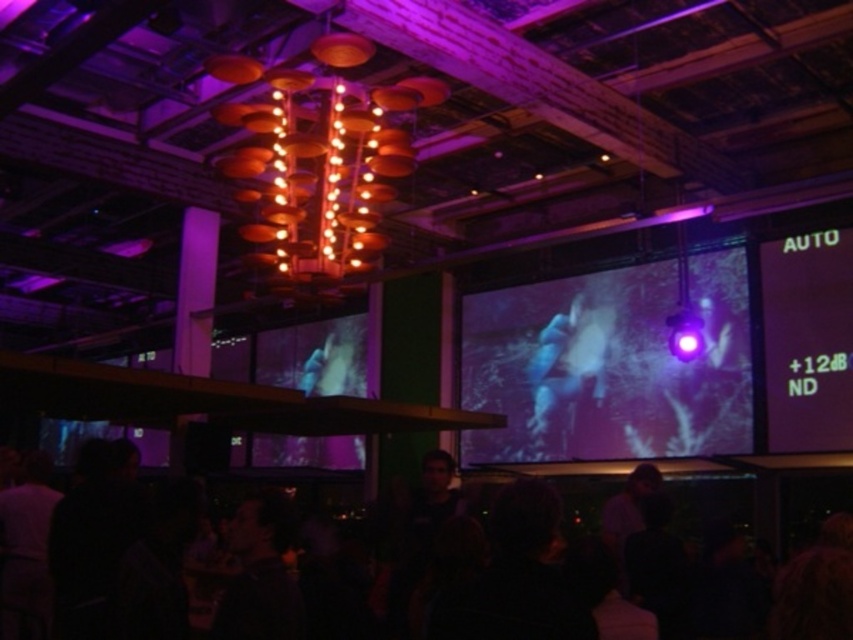
Who is positioned more to the left, black matte crowd at lower center or green matte projection screen at upper right?

black matte crowd at lower center is more to the left.

Between black matte crowd at lower center and green matte projection screen at upper right, which one is positioned lower?

black matte crowd at lower center is lower down.

Does point (752, 461) come behind point (836, 340)?

No, (752, 461) is in front of (836, 340).

Locate an element on the screen. The height and width of the screenshot is (640, 853). black matte crowd at lower center is located at coordinates (758, 500).

Is point (340, 486) positioned after point (599, 378)?

Yes, it is behind point (599, 378).

Does black matte crowd at lower center appear on the left side of blue fabric person at center?

Yes, black matte crowd at lower center is to the left of blue fabric person at center.

Does point (811, 508) lie in front of point (538, 374)?

Yes, point (811, 508) is in front of point (538, 374).

The width and height of the screenshot is (853, 640). Identify the location of black matte crowd at lower center. (758, 500).

Who is shorter, matte black screen at center or green matte projection screen at upper right?

green matte projection screen at upper right is shorter.

The image size is (853, 640). I want to click on matte black screen at center, so click(611, 364).

Is point (572, 326) behind point (805, 243)?

Yes.

Identify the location of matte black screen at center. (611, 364).